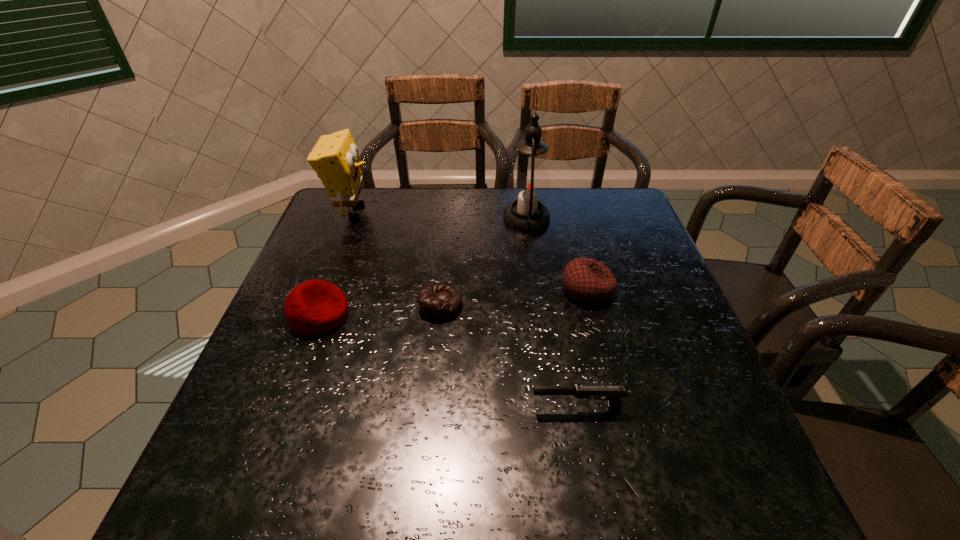
Where is `object that is at the far left corner`? This screenshot has height=540, width=960. object that is at the far left corner is located at coordinates (335, 158).

This screenshot has height=540, width=960. In the image, there is a desktop. Identify the location of free space at the far edge. (571, 218).

The height and width of the screenshot is (540, 960). I want to click on blank space at the near edge of the desktop, so click(x=388, y=478).

At what (x,y) coordinates should I click in order to perform the action: click on vacant space at the left edge of the desktop. Please return your answer as a coordinate pair (x, y). This screenshot has height=540, width=960. Looking at the image, I should click on (361, 232).

Locate an element on the screen. The image size is (960, 540). blank space at the right edge is located at coordinates (640, 331).

Find the location of a particular element. The image size is (960, 540). vacant space at the near left corner of the desktop is located at coordinates (244, 482).

Find the location of `free space between the shortest beanbag and the tallest object`. free space between the shortest beanbag and the tallest object is located at coordinates (484, 262).

This screenshot has height=540, width=960. Find the location of `empty space that is in between the rightmost beanbag and the oil lamp`. empty space that is in between the rightmost beanbag and the oil lamp is located at coordinates (557, 254).

Locate an element on the screen. The width and height of the screenshot is (960, 540). unoccupied position between the tallest object and the shortest object is located at coordinates (484, 262).

Identify the location of vacant region between the rightmost beanbag and the shortest beanbag. The width and height of the screenshot is (960, 540). (514, 298).